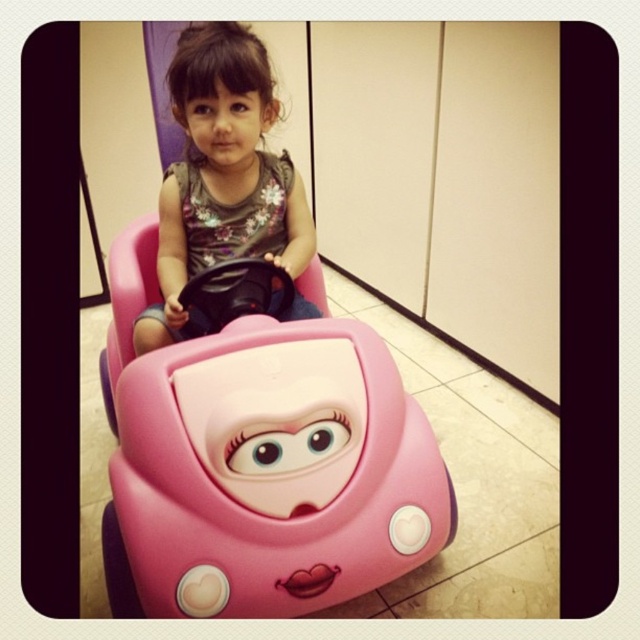
Between pink plastic toy car at center and matte pink toy car at center, which one appears on the right side from the viewer's perspective?

Positioned to the right is pink plastic toy car at center.

Between pink plastic toy car at center and matte pink toy car at center, which one appears on the left side from the viewer's perspective?

Positioned to the left is matte pink toy car at center.

Is point (188, 576) more distant than point (291, 276)?

No, it is in front of (291, 276).

Locate an element on the screen. This screenshot has width=640, height=640. pink plastic toy car at center is located at coordinates (259, 464).